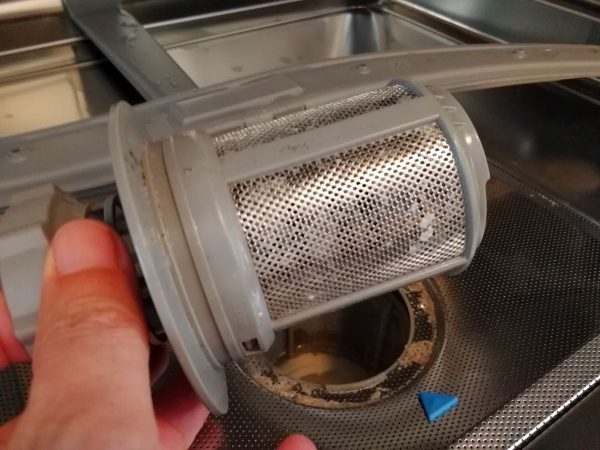
At what (x,y) coordinates should I click in order to perform the action: click on stainless steal side of sink. Please return your answer as a coordinate pair (x, y). This screenshot has height=450, width=600. Looking at the image, I should click on (306, 42).